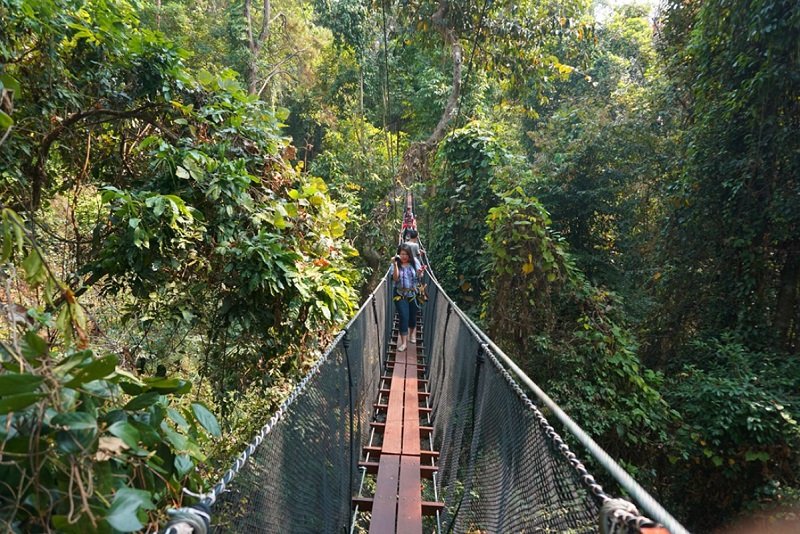
I want to click on wood board, so click(x=394, y=431), click(x=408, y=425), click(x=389, y=486), click(x=402, y=494), click(x=398, y=358), click(x=414, y=360).